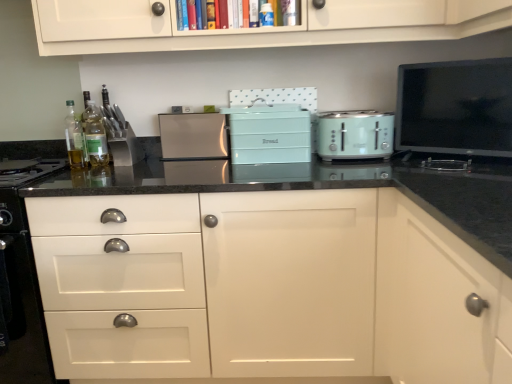
Question: From the image's perspective, is white glossy drawer at lower left positioned above or below white matte cabinet at center?

Choices:
 (A) below
 (B) above

Answer: (A)

Question: Looking at the image, does white glossy drawer at lower left seem bigger or smaller compared to white matte cabinet at center?

Choices:
 (A) small
 (B) big

Answer: (A)

Question: Which is farther from the satin silver toaster at center, which is the second kitchen appliance from front to back?

Choices:
 (A) mint green plastic toaster at center, marked as the first kitchen appliance in a front-to-back arrangement
 (B) matte teal bread bin at center, the second appliance in the right-to-left sequence
 (C) clear glass bottle at left, the 2th bottle in the left-to-right sequence
 (D) white glossy drawer at lower left
 (E) white matte cabinet at center

Answer: (D)

Question: Which of these objects is positioned closest to the black glossy tv at upper right, the 1th appliance in the right-to-left sequence?

Choices:
 (A) mint green plastic toaster at center, the 1th kitchen appliance viewed from the right
 (B) matte teal bread bin at center, acting as the first appliance starting from the left
 (C) translucent glass bottle at left, positioned as the 2th bottle in right-to-left order
 (D) satin silver toaster at center, which is the 2th kitchen appliance in right-to-left order
 (E) white glossy drawer at lower left

Answer: (A)